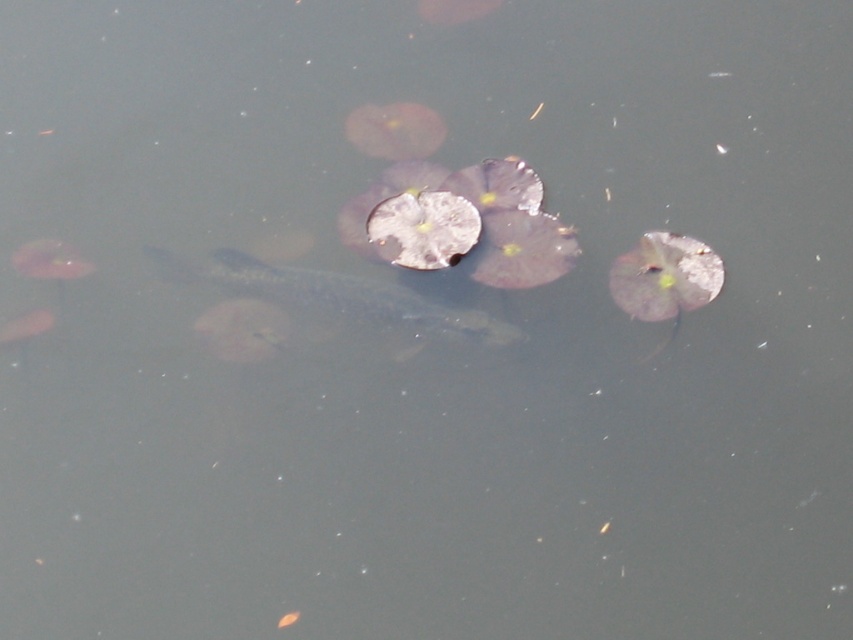
You are standing at the edge of a pond and want to throw a stone to the point marked as point (236, 273). If your maximum throwing distance is 8 feet, will you be able to reach it?

The distance between you and point (236, 273) is 7.76 feet, which is within your maximum throwing distance of 8 feet. Yes, you can reach it.

You are a photographer aiming to capture a closeup of the silvery metallic fish at center. Given the fish is at coordinates point 0.463, 0.395, what is the best position to place your camera to ensure the fish is centered in your shot?

To center the silvery metallic fish at center in your shot, position the camera directly facing the coordinates point (335, 296) where the fish is located.

Consider the image. You are standing at the edge of the water and see a point marked at coordinates [335,296]. What object is located at that point?

The silvery metallic fish at center is located at point [335,296].